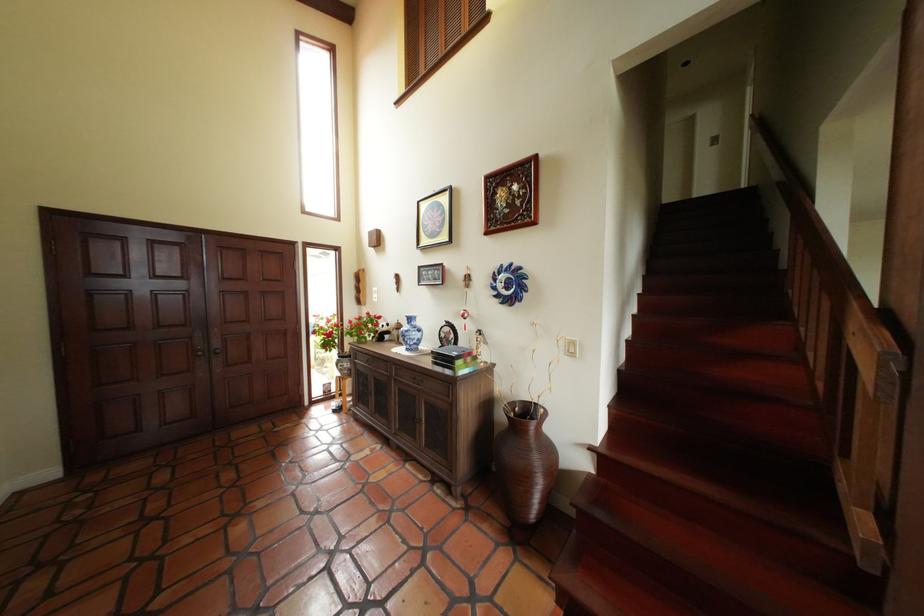
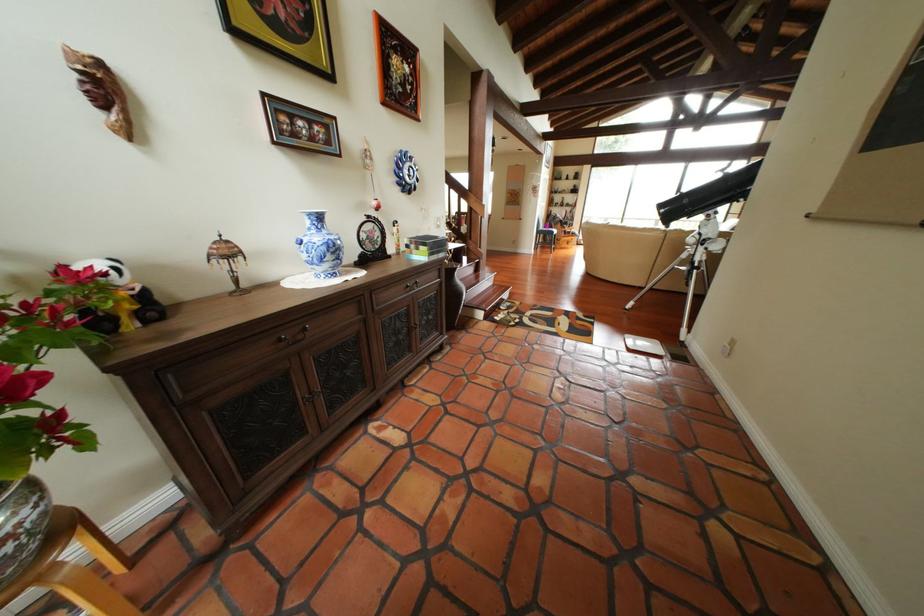
Where in the second image is the point corresponding to [448,360] from the first image?

(444, 249)